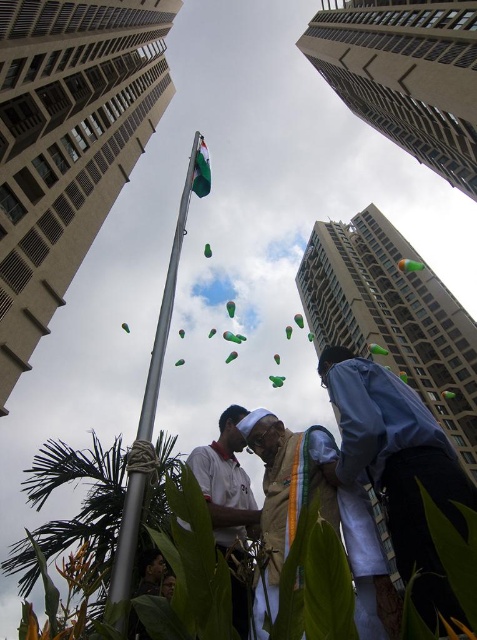
Is silver metallic flag pole at center below green fabric flag at center?

Yes.

Can you confirm if silver metallic flag pole at center is positioned to the right of green fabric flag at center?

In fact, silver metallic flag pole at center is to the left of green fabric flag at center.

I want to click on silver metallic flag pole at center, so click(x=148, y=412).

Does blue fabric shirt at lower right have a greater height compared to white matte shirt at center?

Correct, blue fabric shirt at lower right is much taller as white matte shirt at center.

Is point (339, 358) more distant than point (237, 580)?

Yes, it is.

Between point (362, 388) and point (239, 618), which one is positioned behind?

Positioned behind is point (362, 388).

Identify the location of blue fabric shirt at lower right. The width and height of the screenshot is (477, 640). (x=398, y=467).

Between light brown fabric at center and green fabric flag at center, which one has less height?

With less height is light brown fabric at center.

How much distance is there between light brown fabric at center and green fabric flag at center?

33.94 meters

You are a GUI agent. You are given a task and a screenshot of the screen. Output one action in this format:
    pyautogui.click(x=<x>, y=<y>)
    Task: Click on the light brown fabric at center
    Image resolution: width=477 pixels, height=640 pixels.
    Given the screenshot: What is the action you would take?
    pyautogui.click(x=322, y=515)